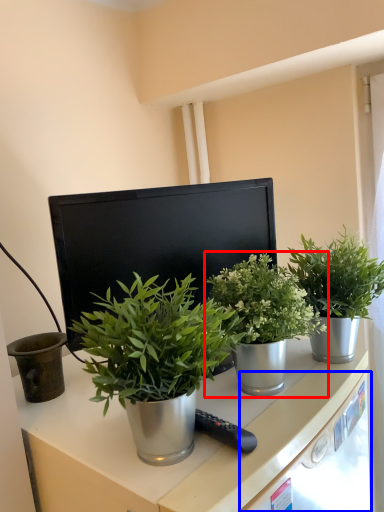
Question: Which object appears closest to the camera in this image, houseplant (highlighted by a red box) or drawer (highlighted by a blue box)?

Choices:
 (A) houseplant
 (B) drawer

Answer: (B)